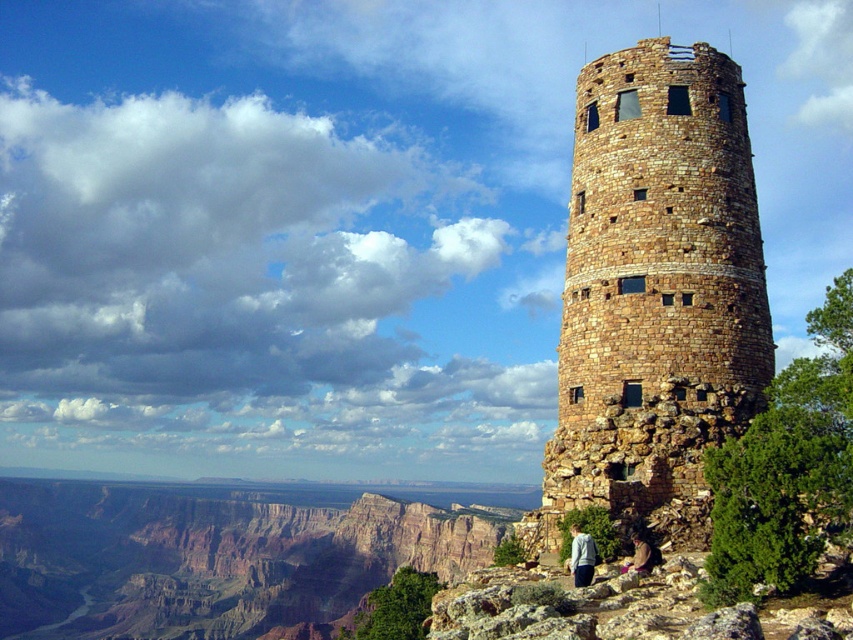
You are a photographer planning to capture a photo of the brown stone tower at center and the brown leather jacket at lower center. Which object should you focus on first if you want to include both in the frame without moving the camera?

The brown stone tower at center is larger than the brown leather jacket at lower center, so you should focus on the brown stone tower at center first to ensure it fits properly in the frame.

You are a photographer at the Grand Canyon. You want to capture a photo that includes both the brown stone tower at center and the light blue fabric jacket at lower center. Based on their positions, which object should you focus on first to ensure both are in frame?

The brown stone tower at center is positioned over the light blue fabric jacket at lower center, so you should focus on the brown stone tower at center first to ensure both are in frame.